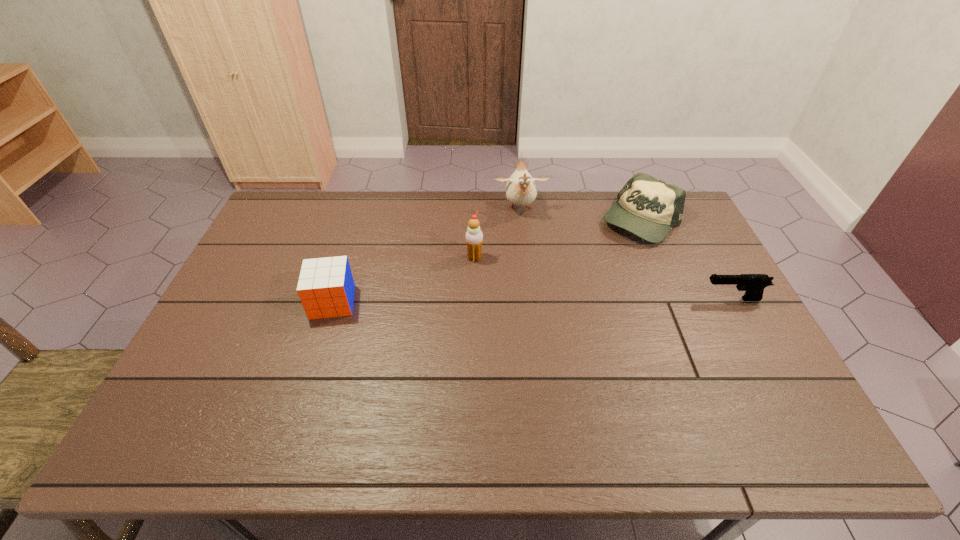
In order to click on vacant region located on the front-facing side of the baseball cap in this screenshot , I will do `click(557, 283)`.

Find the location of a particular element. The image size is (960, 540). vacant space located on the front-facing side of the baseball cap is located at coordinates (580, 266).

Where is `vacant area situated 0.280m on the front-facing side of the baseball cap`? vacant area situated 0.280m on the front-facing side of the baseball cap is located at coordinates (564, 279).

Where is `vacant space located 0.260m at the front with a straw on the icecream`? The width and height of the screenshot is (960, 540). vacant space located 0.260m at the front with a straw on the icecream is located at coordinates (555, 295).

You are a GUI agent. You are given a task and a screenshot of the screen. Output one action in this format:
    pyautogui.click(x=<x>, y=<y>)
    Task: Click on the free location located 0.250m at the front with a straw on the icecream
    The width and height of the screenshot is (960, 540).
    Given the screenshot: What is the action you would take?
    pyautogui.click(x=552, y=293)

Find the location of a particular element. vacant space positioned at the front with a straw on the icecream is located at coordinates 540,288.

Where is `free location located 0.300m at the beak of the bird`? The height and width of the screenshot is (540, 960). free location located 0.300m at the beak of the bird is located at coordinates coord(531,285).

In order to click on vacant area located 0.220m at the beak of the bird in this screenshot , I will do `click(528, 267)`.

You are a GUI agent. You are given a task and a screenshot of the screen. Output one action in this format:
    pyautogui.click(x=<x>, y=<y>)
    Task: Click on the vacant area situated 0.050m at the beak of the bird
    The height and width of the screenshot is (540, 960).
    Given the screenshot: What is the action you would take?
    pyautogui.click(x=523, y=232)

At what (x,y) coordinates should I click in order to perform the action: click on baseball cap located at the far edge. Please return your answer as a coordinate pair (x, y). The width and height of the screenshot is (960, 540). Looking at the image, I should click on (647, 207).